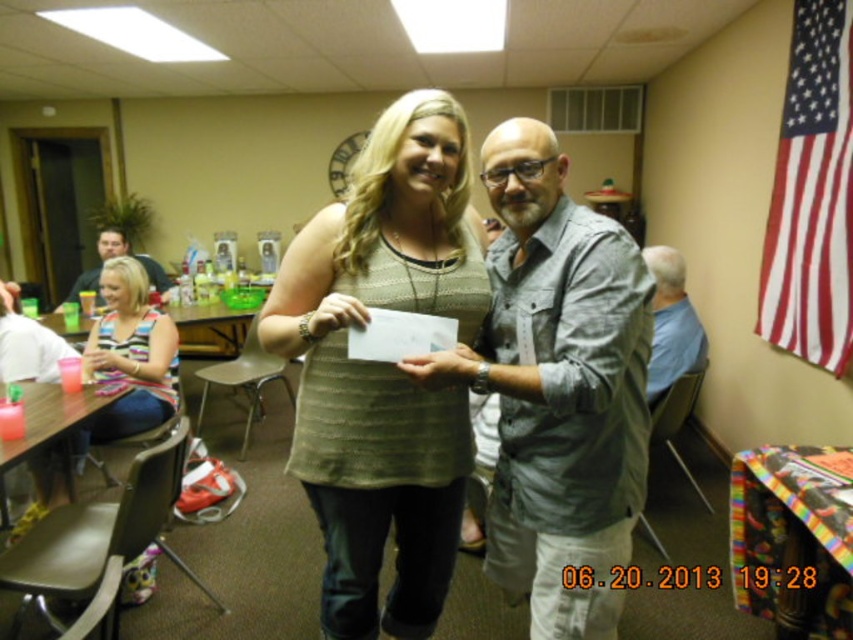
Which is more to the right, striped fabric shirt at left or blue cotton shirt at right?

Positioned to the right is blue cotton shirt at right.

Locate an element on the screen. striped fabric shirt at left is located at coordinates (131, 355).

Where is `gray textured shirt at center`? gray textured shirt at center is located at coordinates (x=558, y=385).

Does gray textured shirt at center appear under red/white striped fabric at upper right?

Yes.

Describe the element at coordinates (558, 385) in the screenshot. I see `gray textured shirt at center` at that location.

The width and height of the screenshot is (853, 640). In order to click on gray textured shirt at center in this screenshot , I will do `click(558, 385)`.

I want to click on blue cotton shirt at right, so click(x=671, y=323).

Who is positioned more to the right, blue cotton shirt at right or blonde hair woman at center?

blue cotton shirt at right is more to the right.

Find the location of a particular element. blue cotton shirt at right is located at coordinates (671, 323).